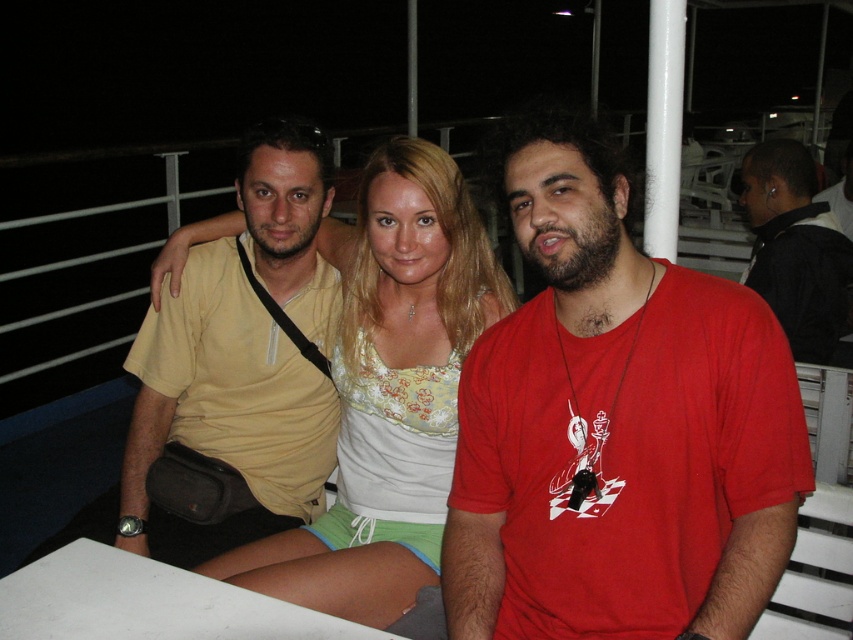
Question: Which point appears closest to the camera in this image?

Choices:
 (A) (436, 147)
 (B) (840, 250)
 (C) (267, 396)
 (D) (543, 560)

Answer: (D)

Question: Which point is farther to the camera?

Choices:
 (A) (810, 193)
 (B) (474, 356)

Answer: (A)

Question: Is matte yellow shirt at center to the right of black leather jacket at right from the viewer's perspective?

Choices:
 (A) no
 (B) yes

Answer: (A)

Question: Considering the relative positions of light beige fabric top at center and matte yellow shirt at center in the image provided, where is light beige fabric top at center located with respect to matte yellow shirt at center?

Choices:
 (A) left
 (B) right

Answer: (B)

Question: Can you confirm if matte red t-shirt at center is thinner than matte yellow shirt at center?

Choices:
 (A) no
 (B) yes

Answer: (B)

Question: Which point is closer to the camera taking this photo?

Choices:
 (A) (358, 612)
 (B) (811, 305)

Answer: (A)